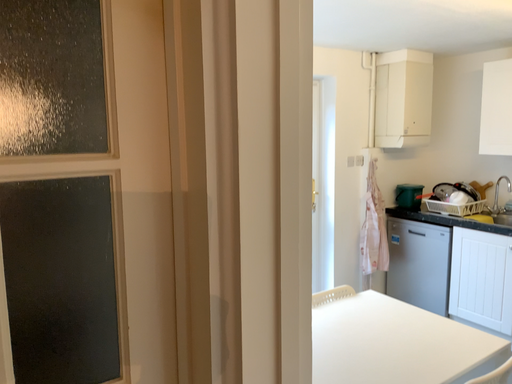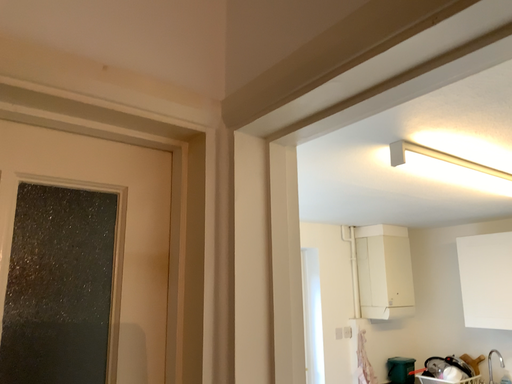
Question: How did the camera likely rotate when shooting the video?

Choices:
 (A) rotated upward
 (B) rotated downward

Answer: (A)